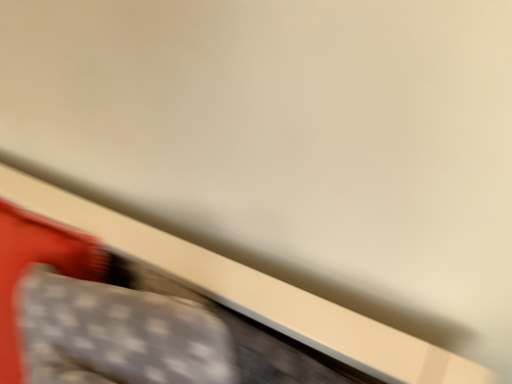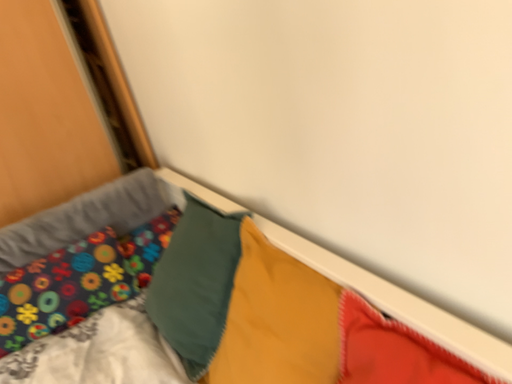
Question: Which way did the camera rotate in the video?

Choices:
 (A) rotated right
 (B) rotated left

Answer: (B)